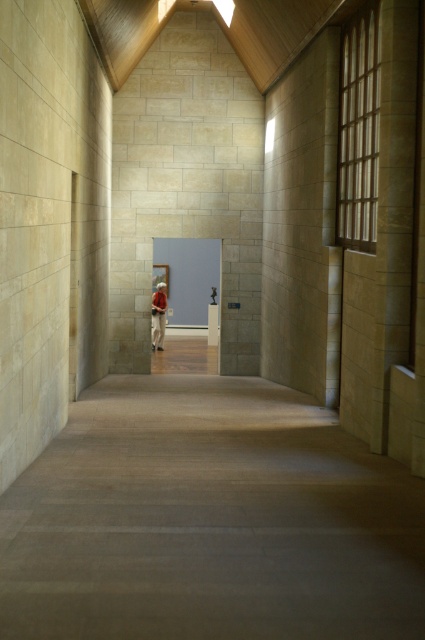
Question: Is matte gray door at center thinner than red fabric person at center?

Choices:
 (A) no
 (B) yes

Answer: (A)

Question: Which of the following is the farthest from the observer?

Choices:
 (A) matte gray door at center
 (B) red fabric person at center

Answer: (A)

Question: Does matte gray door at center appear on the right side of red fabric person at center?

Choices:
 (A) no
 (B) yes

Answer: (B)

Question: Does matte gray door at center appear over red fabric person at center?

Choices:
 (A) yes
 (B) no

Answer: (A)